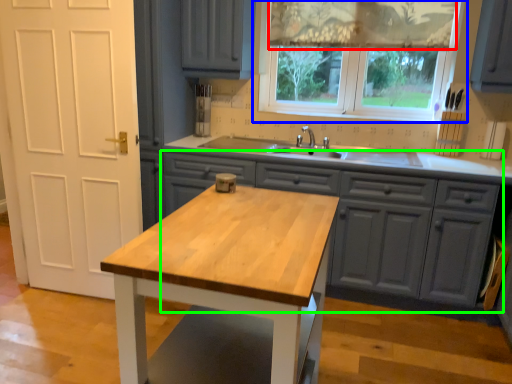
Question: Which object is positioned closest to curtain (highlighted by a red box)? Select from window (highlighted by a blue box) and cabinetry (highlighted by a green box).

Choices:
 (A) window
 (B) cabinetry

Answer: (A)